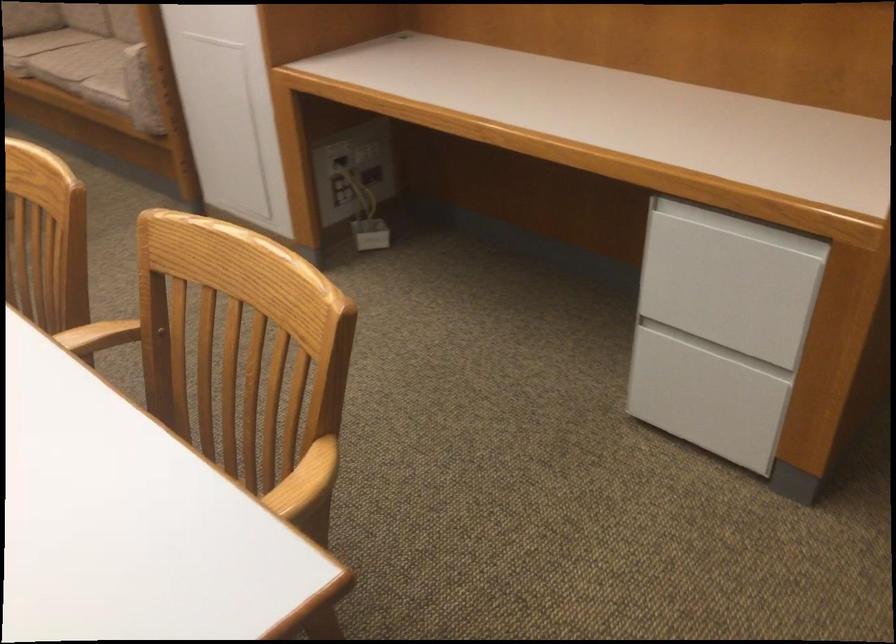
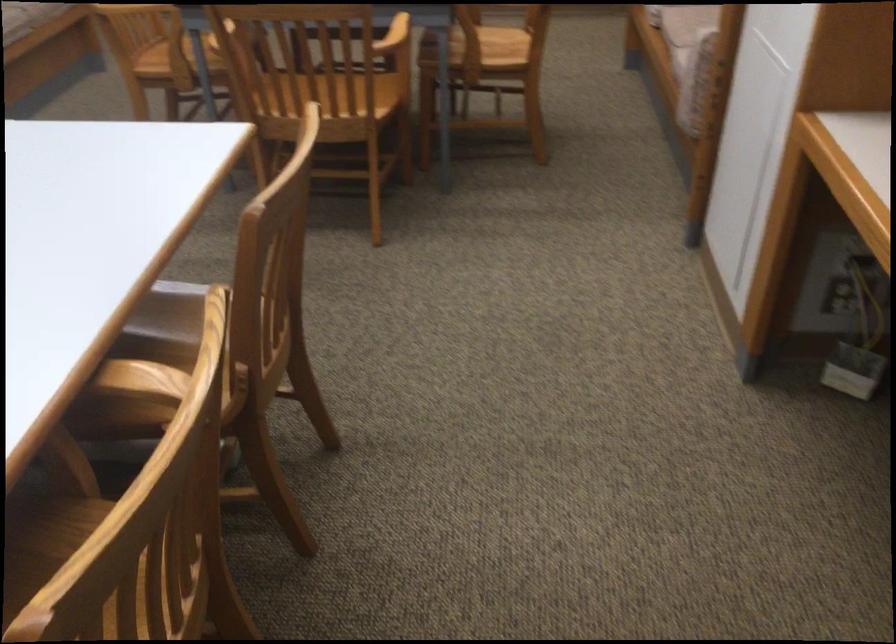
Question: The first image is from the beginning of the video and the second image is from the end. How did the camera likely rotate when shooting the video?

Choices:
 (A) Left
 (B) Right
 (C) Up
 (D) Down

Answer: (A)